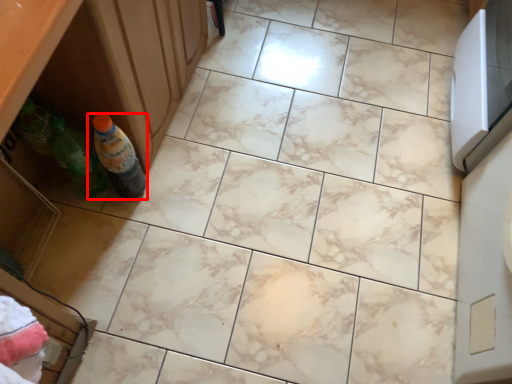
Question: From the image's perspective, considering the relative positions of bottle (annotated by the red box) and drawer in the image provided, where is bottle (annotated by the red box) located with respect to the staircase?

Choices:
 (A) above
 (B) below

Answer: (A)